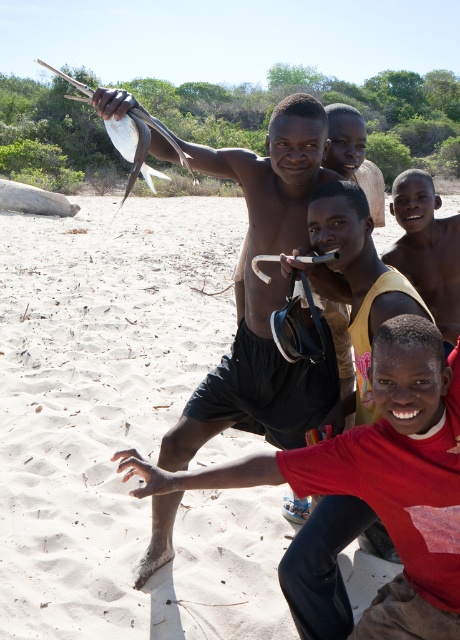
Which of these two, red cotton shirt at lower right or smooth yellow shirt at center, stands shorter?

smooth yellow shirt at center is shorter.

Does red cotton shirt at lower right have a smaller size compared to smooth yellow shirt at center?

Incorrect, red cotton shirt at lower right is not smaller in size than smooth yellow shirt at center.

Identify the location of red cotton shirt at lower right. The image size is (460, 640). (379, 477).

Can you confirm if red cotton shirt at lower right is smaller than matte yellow shirt at center?

No.

The image size is (460, 640). Describe the element at coordinates (379, 477) in the screenshot. I see `red cotton shirt at lower right` at that location.

You are a GUI agent. You are given a task and a screenshot of the screen. Output one action in this format:
    pyautogui.click(x=<x>, y=<y>)
    Task: Click on the red cotton shirt at lower right
    
    Given the screenshot: What is the action you would take?
    pyautogui.click(x=379, y=477)

At what (x,y) coordinates should I click in order to perform the action: click on red cotton shirt at lower right. Please return your answer as a coordinate pair (x, y). The image size is (460, 640). Looking at the image, I should click on (379, 477).

Does smooth skin man at center have a smaller size compared to matte yellow shirt at center?

Actually, smooth skin man at center might be larger than matte yellow shirt at center.

Is smooth skin man at center to the left of matte yellow shirt at center from the viewer's perspective?

Yes, smooth skin man at center is to the left of matte yellow shirt at center.

The height and width of the screenshot is (640, 460). I want to click on smooth skin man at center, so click(263, 285).